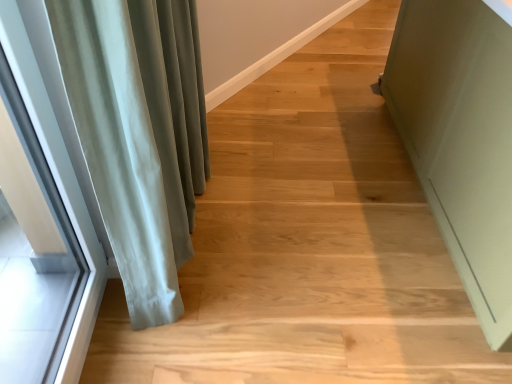
Identify the location of vacant region under clear glass window at left (from a real-world perspective). (93, 338).